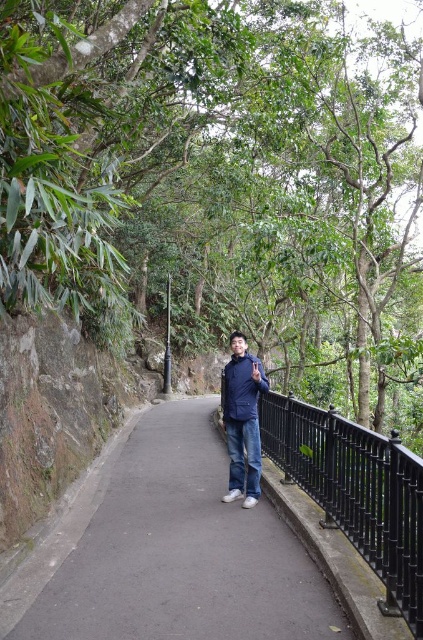
Question: Which of the following is the closest to the observer?

Choices:
 (A) black asphalt path at center
 (B) navy blue jacket at center
 (C) green leafy tree at center

Answer: (C)

Question: Can you confirm if black asphalt path at center is positioned to the right of navy blue jacket at center?

Choices:
 (A) yes
 (B) no

Answer: (B)

Question: Can you confirm if green leafy tree at center is bigger than black metal/rail at right?

Choices:
 (A) yes
 (B) no

Answer: (A)

Question: Is black asphalt path at center further to the viewer compared to navy blue jacket at center?

Choices:
 (A) no
 (B) yes

Answer: (A)

Question: Estimate the real-world distances between objects in this image. Which object is closer to the green leafy tree at center?

Choices:
 (A) navy blue jacket at center
 (B) black asphalt path at center

Answer: (B)

Question: Which of the following is the farthest from the observer?

Choices:
 (A) black metal/rail at right
 (B) green leafy tree at center
 (C) navy blue jacket at center

Answer: (C)